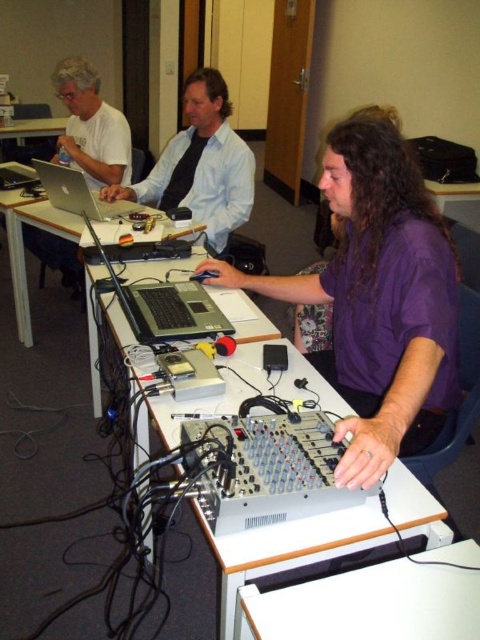
Question: Among these objects, which one is farthest from the camera?

Choices:
 (A) silver metallic audio mixer at center
 (B) silver metallic table at center
 (C) white plastic table at lower center
 (D) purple matte shirt at center

Answer: (D)

Question: Which of these objects is positioned closest to the silver metallic laptop at left?

Choices:
 (A) silver/black laptop at center
 (B) white plastic table at lower center
 (C) matte black shirt at center
 (D) silver metallic audio mixer at center

Answer: (C)

Question: Does white plastic table at lower center appear on the left side of white matte shirt at upper left?

Choices:
 (A) yes
 (B) no

Answer: (B)

Question: Can you confirm if silver metallic audio mixer at center is positioned below matte black shirt at center?

Choices:
 (A) yes
 (B) no

Answer: (A)

Question: In this image, where is purple matte shirt at center located relative to white plastic table at lower center?

Choices:
 (A) right
 (B) left

Answer: (A)

Question: Among these objects, which one is farthest from the camera?

Choices:
 (A) silver metallic table at center
 (B) matte black shirt at center

Answer: (B)